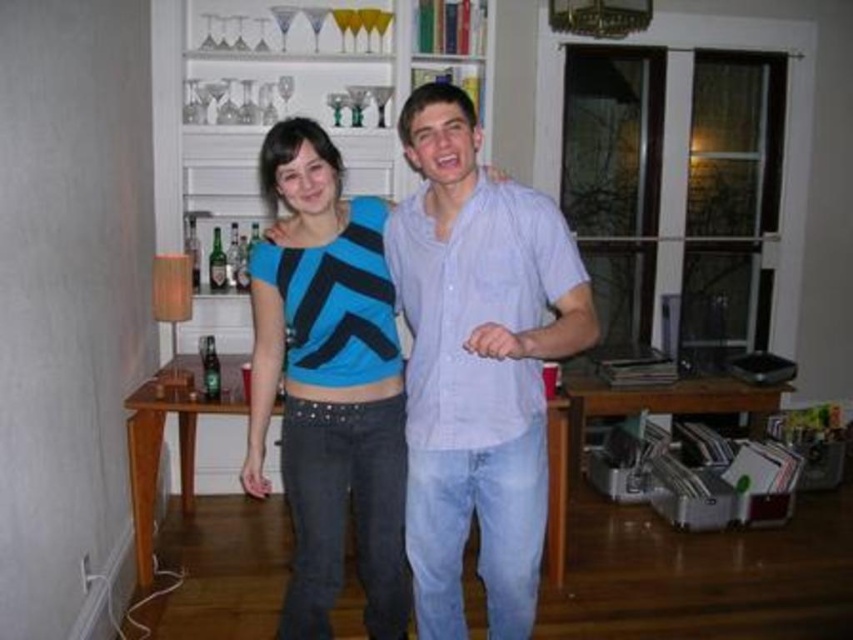
Looking at this image, you are a photographer setting up a shoot in this living room. You need to ensure that both the blue matte shirt at center and the blue matte jersey at center are visible in the frame. Based on their positions, which one is covering part of the other?

The blue matte shirt at center is positioned over the blue matte jersey at center, so the shirt is covering part of the jersey.

Looking at this image, you are standing in the living room and need to place a new decorative item on the shelf. The shelf can only hold items that are not directly in front of the blue matte shirt at center. Based on the coordinates provided, where should you place the item?

The blue matte shirt at center is located at point [477,364]. To avoid placing the decorative item directly in front of it, you should position the item either to the left or right of these coordinates on the shelf.

You are a photographer setting up a shoot in this living room. You need to position a large camera tripod that requires 1.5 meters of clear space in front of it. You see the blue matte jersey at center and the white wooden bookshelf at upper center. Is there enough space between them for the tripod?

The blue matte jersey at center is in front of the white wooden bookshelf at upper center, so there is no space between them. The tripod would not fit between them.